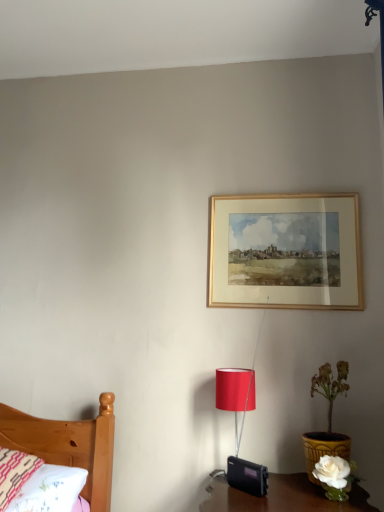
The width and height of the screenshot is (384, 512). Identify the location of matte red lampshade at lower center. (235, 392).

This screenshot has height=512, width=384. In order to click on lamp located below the white ceramic vase at lower right (from the image's perspective) in this screenshot , I will do `click(235, 392)`.

Looking at this image, is white ceramic vase at lower right aimed at matte red lampshade at lower center?

No, white ceramic vase at lower right is not turned towards matte red lampshade at lower center.

Can you tell me how much white ceramic vase at lower right and matte red lampshade at lower center differ in facing direction?

white ceramic vase at lower right and matte red lampshade at lower center are facing 0.000363 degrees away from each other.

Does white ceramic vase at lower right have a lesser height compared to matte red lampshade at lower center?

In fact, white ceramic vase at lower right may be taller than matte red lampshade at lower center.

Which of these two, embroidered cotton pillow at lower left or matte red lampshade at lower center, is smaller?

matte red lampshade at lower center.

Is embroidered cotton pillow at lower left at the right side of matte red lampshade at lower center?

No.

What's the angular difference between embroidered cotton pillow at lower left and matte red lampshade at lower center's facing directions?

They differ by 1.09 degrees in their facing directions.

From the image's perspective, between embroidered cotton pillow at lower left and matte red lampshade at lower center, which one is located above?

matte red lampshade at lower center is shown above in the image.

Which of these two, matte red lampshade at lower center or embroidered cotton pillow at lower left, stands taller?

Standing taller between the two is matte red lampshade at lower center.

Does matte red lampshade at lower center appear on the right side of embroidered cotton pillow at lower left?

Yes, matte red lampshade at lower center is to the right of embroidered cotton pillow at lower left.

From a real-world perspective, who is located lower, matte red lampshade at lower center or embroidered cotton pillow at lower left?

embroidered cotton pillow at lower left.

Is point (331, 392) positioned in front of point (237, 258)?

Yes, point (331, 392) is in front of point (237, 258).

Considering the sizes of white ceramic vase at lower right and gold wooden picture frame at upper center in the image, is white ceramic vase at lower right bigger or smaller than gold wooden picture frame at upper center?

In the image, white ceramic vase at lower right appears to be smaller than gold wooden picture frame at upper center.

Would you say gold wooden picture frame at upper center is part of white ceramic vase at lower right's contents?

No, gold wooden picture frame at upper center is not inside white ceramic vase at lower right.

Consider the image. Does white ceramic vase at lower right turn towards gold wooden picture frame at upper center?

No, white ceramic vase at lower right is not facing towards gold wooden picture frame at upper center.

Is embroidered cotton pillow at lower left bigger than gold wooden picture frame at upper center?

Indeed, embroidered cotton pillow at lower left has a larger size compared to gold wooden picture frame at upper center.

From the picture: From a real-world perspective, is embroidered cotton pillow at lower left above or below gold wooden picture frame at upper center?

embroidered cotton pillow at lower left is below gold wooden picture frame at upper center.

Between embroidered cotton pillow at lower left and gold wooden picture frame at upper center, which one is positioned behind?

gold wooden picture frame at upper center is behind.

Considering the sizes of objects matte red lampshade at lower center and gold wooden picture frame at upper center in the image provided, who is taller, matte red lampshade at lower center or gold wooden picture frame at upper center?

Standing taller between the two is gold wooden picture frame at upper center.

Could you measure the distance between matte red lampshade at lower center and gold wooden picture frame at upper center?

matte red lampshade at lower center and gold wooden picture frame at upper center are 21.72 inches apart.

Which is behind, matte red lampshade at lower center or gold wooden picture frame at upper center?

gold wooden picture frame at upper center is behind.

Which is in front, point (238, 384) or point (287, 243)?

The point (238, 384) is closer.

In terms of size, does gold wooden picture frame at upper center appear bigger or smaller than matte red lampshade at lower center?

gold wooden picture frame at upper center is bigger than matte red lampshade at lower center.

Does point (330, 284) come farther from viewer compared to point (224, 387)?

Yes, point (330, 284) is farther from viewer.

Is gold wooden picture frame at upper center located outside matte red lampshade at lower center?

gold wooden picture frame at upper center lies outside matte red lampshade at lower center's area.

Considering the relative positions of gold wooden picture frame at upper center and matte red lampshade at lower center in the image provided, is gold wooden picture frame at upper center in front of matte red lampshade at lower center?

No, gold wooden picture frame at upper center is further to the viewer.

You are a GUI agent. You are given a task and a screenshot of the screen. Output one action in this format:
    pyautogui.click(x=<x>, y=<y>)
    Task: Click on the houseplant to the right of matte red lampshade at lower center
    This screenshot has width=384, height=512.
    Given the screenshot: What is the action you would take?
    pyautogui.click(x=328, y=418)

Find the location of a particular element. The image size is (384, 512). lamp lying above the embroidered cotton pillow at lower left (from the image's perspective) is located at coordinates (235, 392).

Which object lies nearer to the anchor point gold wooden picture frame at upper center, embroidered cotton pillow at lower left or matte red lampshade at lower center?

The object closer to gold wooden picture frame at upper center is matte red lampshade at lower center.

Based on their spatial positions, is white ceramic vase at lower right or embroidered cotton pillow at lower left closer to gold wooden picture frame at upper center?

Among the two, white ceramic vase at lower right is located nearer to gold wooden picture frame at upper center.

Considering their positions, is gold wooden picture frame at upper center positioned further to white ceramic vase at lower right than matte red lampshade at lower center?

gold wooden picture frame at upper center.

When comparing their distances from gold wooden picture frame at upper center, does embroidered cotton pillow at lower left or white ceramic vase at lower right seem further?

embroidered cotton pillow at lower left.

Based on their spatial positions, is white ceramic vase at lower right or gold wooden picture frame at upper center closer to embroidered cotton pillow at lower left?

white ceramic vase at lower right is closer to embroidered cotton pillow at lower left.

Considering their positions, is white ceramic vase at lower right positioned further to gold wooden picture frame at upper center than matte red lampshade at lower center?

Among the two, matte red lampshade at lower center is located further to gold wooden picture frame at upper center.

Considering their positions, is gold wooden picture frame at upper center positioned further to matte red lampshade at lower center than white ceramic vase at lower right?

Among the two, gold wooden picture frame at upper center is located further to matte red lampshade at lower center.

From the image, which object appears to be farther from white ceramic vase at lower right, embroidered cotton pillow at lower left or gold wooden picture frame at upper center?

embroidered cotton pillow at lower left is positioned further to the anchor white ceramic vase at lower right.

You are a GUI agent. You are given a task and a screenshot of the screen. Output one action in this format:
    pyautogui.click(x=<x>, y=<y>)
    Task: Click on the houseplant between gold wooden picture frame at upper center and matte red lampshade at lower center vertically
    The image size is (384, 512).
    Given the screenshot: What is the action you would take?
    pyautogui.click(x=328, y=418)

Identify the location of picture frame between embroidered cotton pillow at lower left and white ceramic vase at lower right from left to right. Image resolution: width=384 pixels, height=512 pixels. (285, 252).

This screenshot has height=512, width=384. I want to click on lamp between embroidered cotton pillow at lower left and white ceramic vase at lower right in the horizontal direction, so click(235, 392).

In order to click on lamp situated between embroidered cotton pillow at lower left and gold wooden picture frame at upper center from left to right in this screenshot , I will do `click(235, 392)`.